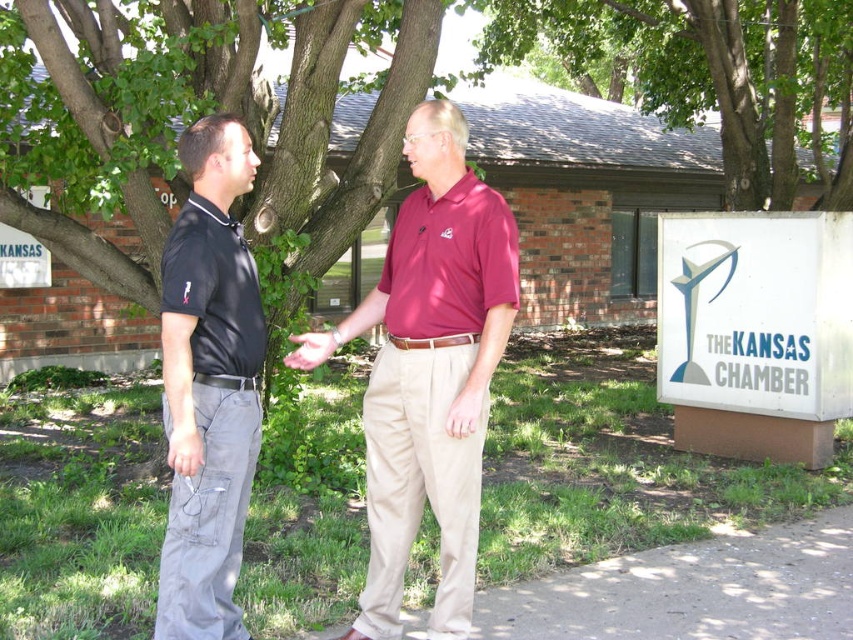
Describe the element at coordinates (209, 384) in the screenshot. The width and height of the screenshot is (853, 640). I see `matte black shirt at left` at that location.

Where is `matte black shirt at left`? matte black shirt at left is located at coordinates tap(209, 384).

Is point (198, 634) positioned in front of point (285, 358)?

Yes, it is.

You are a GUI agent. You are given a task and a screenshot of the screen. Output one action in this format:
    pyautogui.click(x=<x>, y=<y>)
    Task: Click on the matte black shirt at left
    This screenshot has height=640, width=853.
    Given the screenshot: What is the action you would take?
    pyautogui.click(x=209, y=384)

Between white plastic sign at right and matte gray hand at center, which one appears on the right side from the viewer's perspective?

Positioned to the right is white plastic sign at right.

Image resolution: width=853 pixels, height=640 pixels. What do you see at coordinates (756, 312) in the screenshot?
I see `white plastic sign at right` at bounding box center [756, 312].

Does point (811, 336) come in front of point (316, 339)?

No, it is not.

Where is `white plastic sign at right`? white plastic sign at right is located at coordinates (756, 312).

Does matte black shirt at left have a lesser height compared to white plastic sign at right?

No, matte black shirt at left is not shorter than white plastic sign at right.

In the scene shown: Does matte black shirt at left appear on the left side of white plastic sign at right?

Indeed, matte black shirt at left is positioned on the left side of white plastic sign at right.

This screenshot has width=853, height=640. I want to click on matte black shirt at left, so click(x=209, y=384).